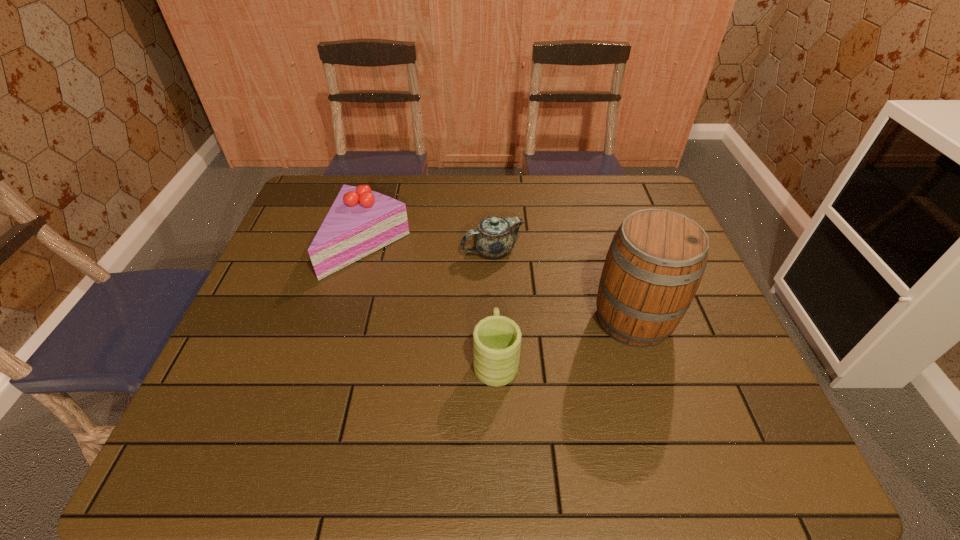
The image size is (960, 540). Find the location of `the tallest object`. the tallest object is located at coordinates (655, 263).

Locate an element on the screen. cider is located at coordinates (655, 263).

Locate an element on the screen. The width and height of the screenshot is (960, 540). cake is located at coordinates (360, 221).

Identify the location of the third shortest object. (360, 221).

The height and width of the screenshot is (540, 960). I want to click on mug, so click(x=496, y=339).

This screenshot has height=540, width=960. I want to click on chinaware, so click(495, 237).

Locate an element on the screen. The width and height of the screenshot is (960, 540). vacant space located on the back of the tallest object is located at coordinates coord(613,257).

Find the location of `vacant space situated on the back of the cake`. vacant space situated on the back of the cake is located at coordinates (382, 199).

I want to click on vacant space situated 0.290m on the side of the mug with the handle, so click(x=492, y=253).

The width and height of the screenshot is (960, 540). Identify the location of vacant space located on the side of the mug with the handle. (492, 235).